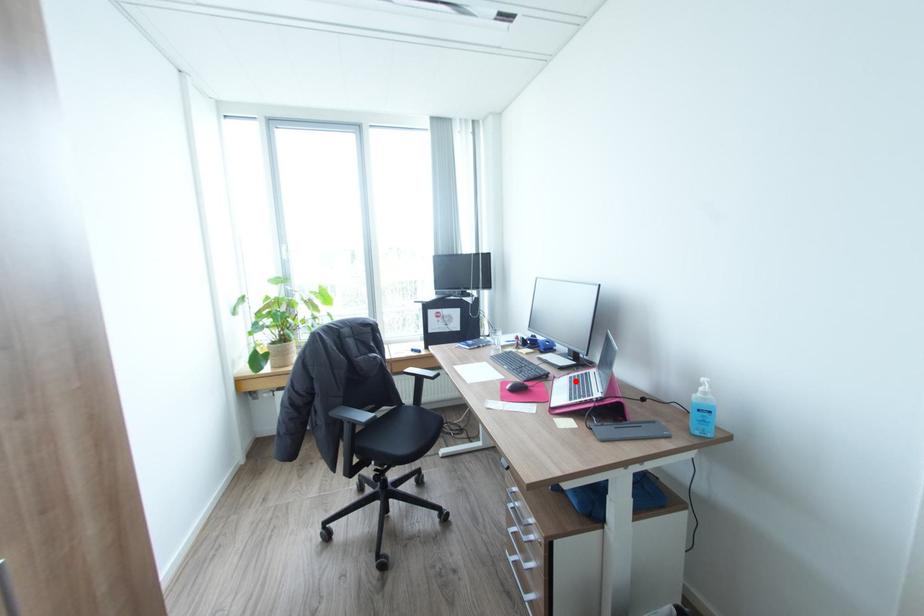
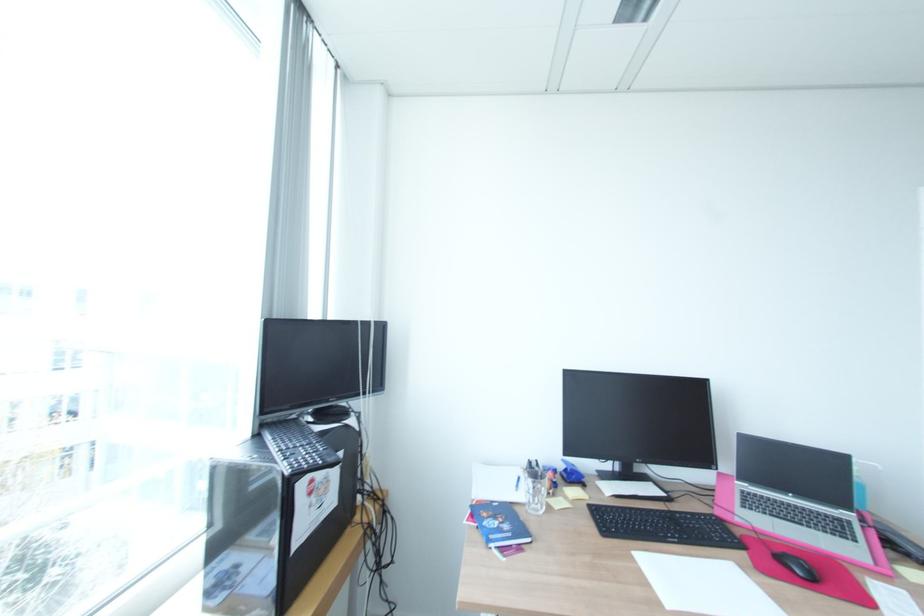
The point at the highlighted location is marked in the first image. Where is the corresponding point in the second image?

(770, 513)